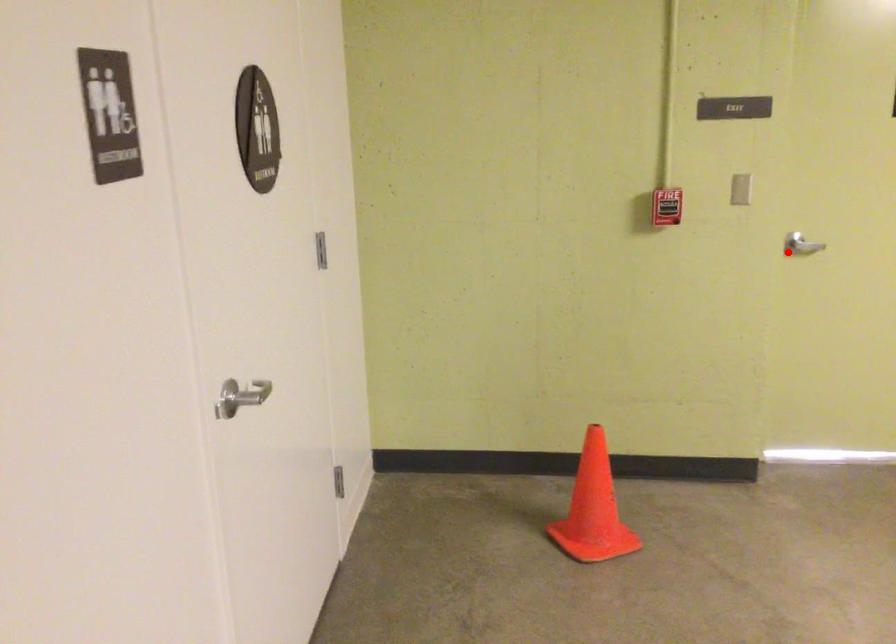
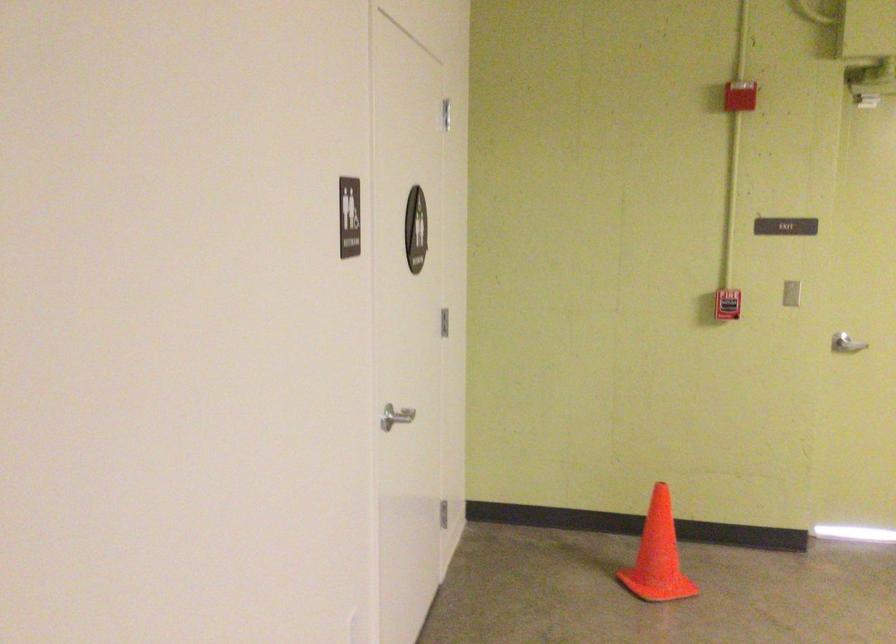
In the second image, find the point that corresponds to the highlighted location in the first image.

(846, 344)